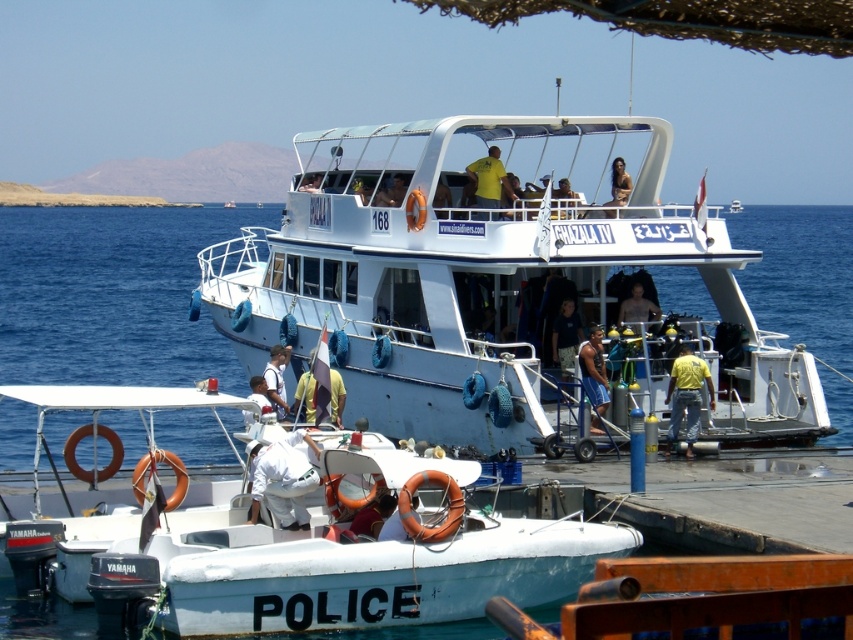
Who is more distant from viewer, (x=688, y=356) or (x=265, y=381)?

Point (x=265, y=381)

Does yellow cotton shirt at center have a greater height compared to white fabric shirt at center?

Indeed, yellow cotton shirt at center has a greater height compared to white fabric shirt at center.

Which is in front, point (666, 448) or point (260, 381)?

Point (666, 448) is in front.

Where is `yellow cotton shirt at center`? The height and width of the screenshot is (640, 853). yellow cotton shirt at center is located at coordinates (686, 396).

Can you confirm if yellow fabric flag at center is bigger than matte yellow shirt at center?

No, yellow fabric flag at center is not bigger than matte yellow shirt at center.

Does point (335, 387) come closer to viewer compared to point (630, 288)?

Yes, point (335, 387) is closer to viewer.

Identify the location of yellow fabric flag at center. (306, 392).

Looking at this image, does yellow cotton shirt at center have a lesser height compared to brown textured fabric at upper center?

No, yellow cotton shirt at center is not shorter than brown textured fabric at upper center.

Is yellow cotton shirt at center taller than brown textured fabric at upper center?

Yes, yellow cotton shirt at center is taller than brown textured fabric at upper center.

Identify the location of yellow cotton shirt at center. The height and width of the screenshot is (640, 853). (686, 396).

In order to click on yellow cotton shirt at center in this screenshot , I will do `click(686, 396)`.